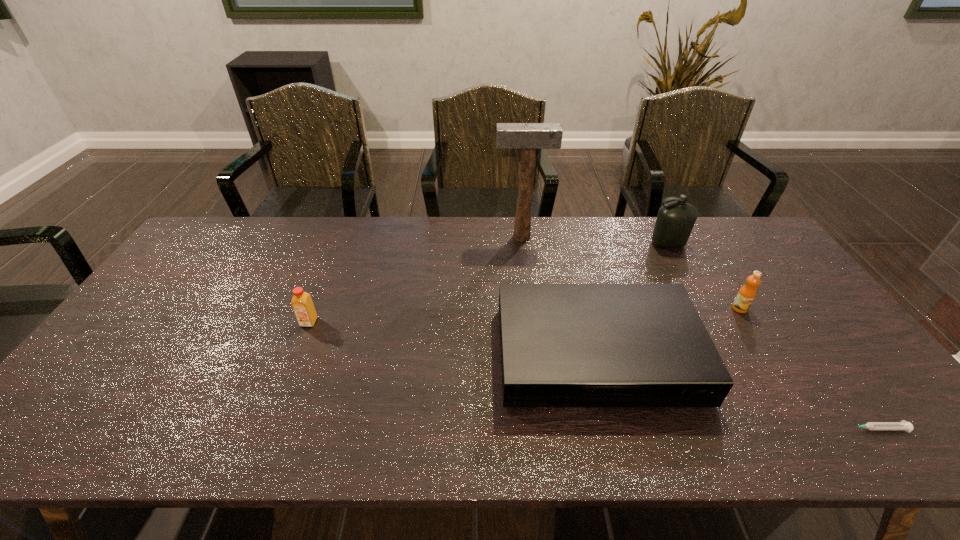
What are the coordinates of `the tallest object` in the screenshot? It's located at (527, 137).

This screenshot has height=540, width=960. In order to click on bottle in this screenshot , I will do `click(675, 220)`.

This screenshot has height=540, width=960. I want to click on the fifth shortest object, so click(675, 220).

You are a GUI agent. You are given a task and a screenshot of the screen. Output one action in this format:
    pyautogui.click(x=<x>, y=<y>)
    Task: Click on the right orange juice
    
    Given the screenshot: What is the action you would take?
    pyautogui.click(x=747, y=293)

This screenshot has height=540, width=960. Find the location of `the fifth object from left to right`. the fifth object from left to right is located at coordinates (747, 293).

This screenshot has height=540, width=960. In order to click on the nearer orange juice in this screenshot , I will do `click(302, 303)`.

Identify the location of the left orange juice. click(x=302, y=303).

Where is `CD player`? CD player is located at coordinates (562, 345).

Identify the location of the nearest object. The height and width of the screenshot is (540, 960). (903, 425).

Locate an element on the screen. This screenshot has width=960, height=540. syringe is located at coordinates (903, 425).